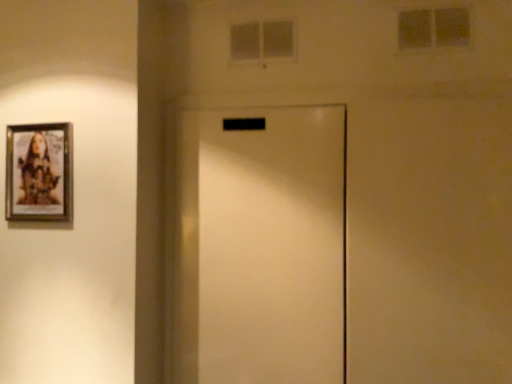
Question: Should I look upward or downward to see wooden-framed photo at left?

Choices:
 (A) down
 (B) up

Answer: (B)